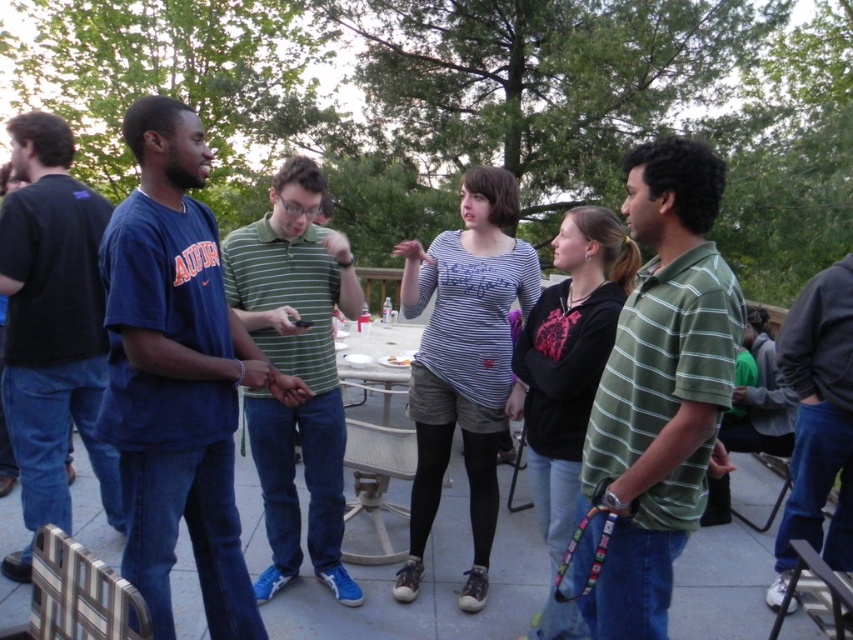
Is point (15, 330) closer to viewer compared to point (276, 545)?

Yes, point (15, 330) is in front of point (276, 545).

Does dark blue t-shirt at left have a smaller size compared to green striped polo shirt at center?

Indeed, dark blue t-shirt at left has a smaller size compared to green striped polo shirt at center.

Which is behind, point (61, 225) or point (316, 294)?

The point (61, 225) is behind.

The image size is (853, 640). I want to click on dark blue t-shirt at left, so click(x=53, y=321).

Does green striped polo shirt at right have a greater height compared to metallic silver picnic table at center?

Indeed, green striped polo shirt at right has a greater height compared to metallic silver picnic table at center.

Who is positioned more to the left, green striped polo shirt at right or metallic silver picnic table at center?

metallic silver picnic table at center

Where is `green striped polo shirt at right`? The height and width of the screenshot is (640, 853). green striped polo shirt at right is located at coordinates (660, 387).

Which is below, green striped polo shirt at right or green striped polo shirt at center?

green striped polo shirt at right is below.

Can you confirm if green striped polo shirt at right is taller than green striped polo shirt at center?

No, green striped polo shirt at right is not taller than green striped polo shirt at center.

Which is in front, point (689, 300) or point (335, 426)?

Point (689, 300) is more forward.

Where is `green striped polo shirt at right`? The width and height of the screenshot is (853, 640). green striped polo shirt at right is located at coordinates (660, 387).